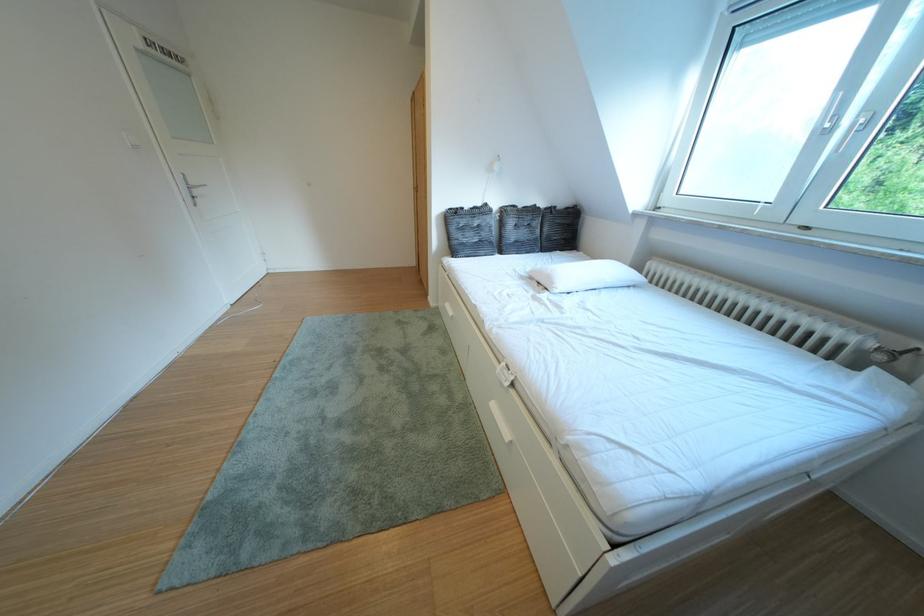
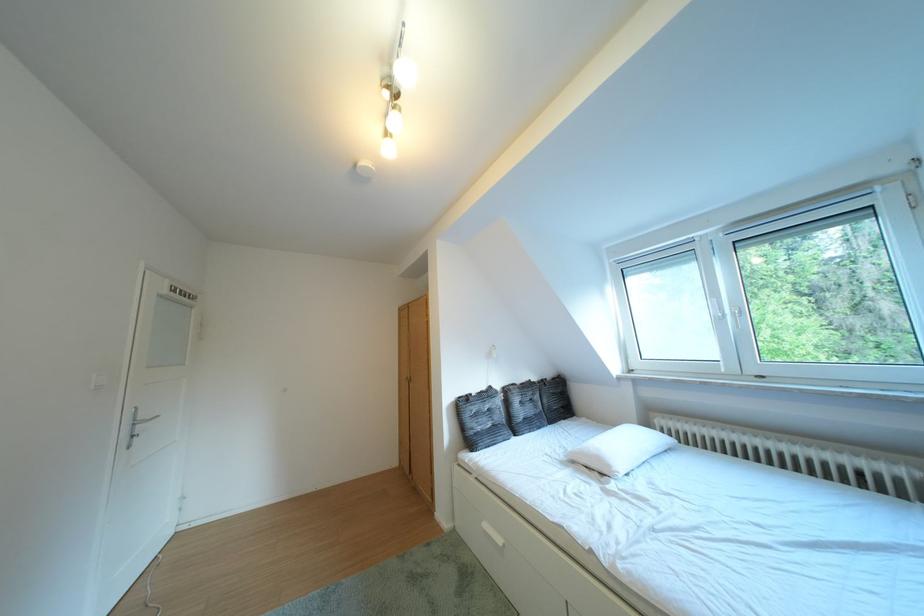
Find the pixel in the second image that matches point 500,209 in the first image.

(504, 392)